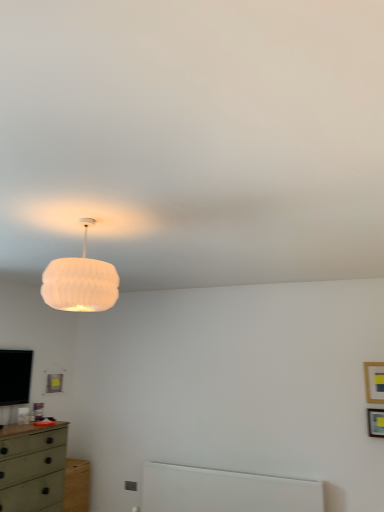
Question: From a real-world perspective, is white ribbed shade at upper center physically below green matte chest of drawers at lower left?

Choices:
 (A) no
 (B) yes

Answer: (A)

Question: Can you confirm if white ribbed shade at upper center is positioned to the left of green matte chest of drawers at lower left?

Choices:
 (A) no
 (B) yes

Answer: (A)

Question: Is white ribbed shade at upper center outside green matte chest of drawers at lower left?

Choices:
 (A) no
 (B) yes

Answer: (B)

Question: Does white ribbed shade at upper center have a smaller size compared to green matte chest of drawers at lower left?

Choices:
 (A) no
 (B) yes

Answer: (B)

Question: Is white ribbed shade at upper center facing towards green matte chest of drawers at lower left?

Choices:
 (A) yes
 (B) no

Answer: (B)

Question: Is wooden picture frame at upper right, the 2th picture frame ordered from the bottom, inside the boundaries of wooden picture frame at upper right, which appears as the second picture frame when viewed from the top, or outside?

Choices:
 (A) outside
 (B) inside

Answer: (A)

Question: From a real-world perspective, relative to wooden picture frame at upper right, which appears as the second picture frame when viewed from the top, is wooden picture frame at upper right, the 2th picture frame ordered from the bottom, vertically above or below?

Choices:
 (A) below
 (B) above

Answer: (B)

Question: In terms of height, does wooden picture frame at upper right, which is the first picture frame from top to bottom, look taller or shorter compared to wooden picture frame at upper right, positioned as the first picture frame in bottom-to-top order?

Choices:
 (A) tall
 (B) short

Answer: (A)

Question: Visually, is wooden picture frame at upper right, which is the first picture frame from top to bottom, positioned to the left or to the right of wooden picture frame at upper right, which appears as the second picture frame when viewed from the top?

Choices:
 (A) right
 (B) left

Answer: (A)

Question: From the image's perspective, relative to white ribbed shade at upper center, is wooden picture frame at upper right, which is the first picture frame from top to bottom, above or below?

Choices:
 (A) below
 (B) above

Answer: (A)

Question: Is point (367, 389) positioned closer to the camera than point (91, 264)?

Choices:
 (A) farther
 (B) closer

Answer: (A)

Question: In terms of width, does wooden picture frame at upper right, which is the first picture frame from top to bottom, look wider or thinner when compared to white ribbed shade at upper center?

Choices:
 (A) wide
 (B) thin

Answer: (B)

Question: Is wooden picture frame at upper right, the 2th picture frame ordered from the bottom, to the left or to the right of white ribbed shade at upper center in the image?

Choices:
 (A) left
 (B) right

Answer: (B)

Question: Is white ribbed shade at upper center in front of or behind green matte chest of drawers at lower left in the image?

Choices:
 (A) behind
 (B) front

Answer: (B)

Question: Is point (84, 236) closer or farther from the camera than point (41, 468)?

Choices:
 (A) farther
 (B) closer

Answer: (B)